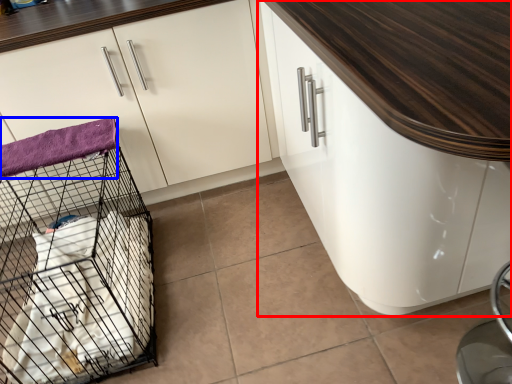
Question: Which point is closer to the camera, cabinetry (highlighted by a red box) or blanket (highlighted by a blue box)?

Choices:
 (A) cabinetry
 (B) blanket

Answer: (A)